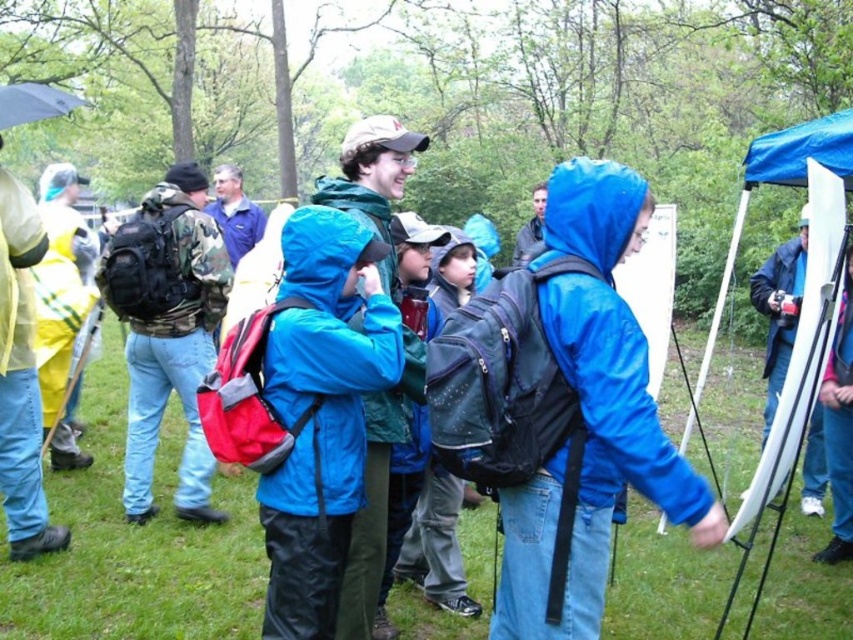
You are a hiker who needs to retrieve an item from your backpack, but you notice that the camo fabric backpack at left and the yellow hazmat suit at left are blocking your path. Can you estimate whether there is enough space between them to squeeze through?

The distance between the camo fabric backpack at left and the yellow hazmat suit at left is 25.53 inches, which is approximately 2 feet. This should provide sufficient space for a hiker to squeeze through comfortably.

You are a hiker who wants to know if the camo fabric backpack at left is positioned lower than the yellow waterproof jacket at left. Based on the scene, can you confirm this?

Yes, the camo fabric backpack at left is located below the yellow waterproof jacket at left according to the description.

You are a hiker who needs to pass between the blue matte jacket at center and the yellow waterproof jacket at left. Your backpack is 2 meters wide. Can you fit through the space between them?

The distance between the blue matte jacket at center and the yellow waterproof jacket at left is 3.41 meters. Since your backpack is 2 meters wide, you can easily pass through the space as it is wider than your backpack.